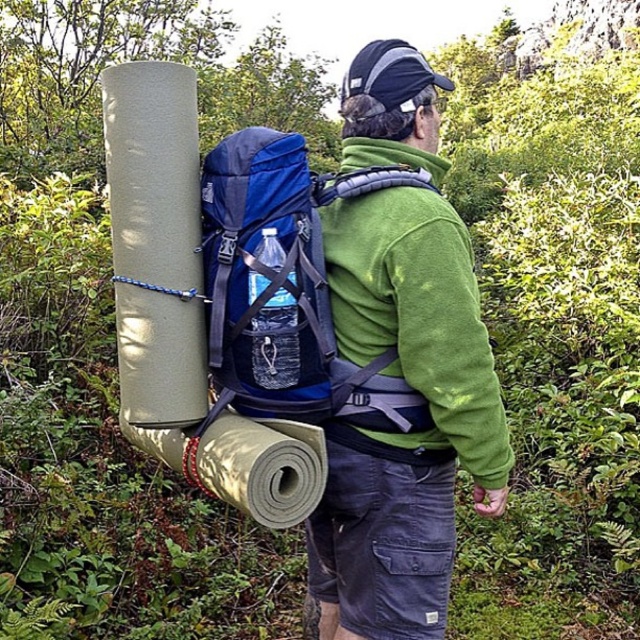
Question: Which point appears closest to the camera in this image?

Choices:
 (A) (369, 148)
 (B) (292, 189)

Answer: (B)

Question: Does blue fabric backpack at center appear over green fleece jacket at back?

Choices:
 (A) no
 (B) yes

Answer: (B)

Question: Can you confirm if blue fabric backpack at center is positioned to the left of green fleece jacket at back?

Choices:
 (A) yes
 (B) no

Answer: (A)

Question: Among these points, which one is farthest from the camera?

Choices:
 (A) (216, 312)
 (B) (506, 477)

Answer: (B)

Question: Is blue fabric backpack at center behind green fleece jacket at back?

Choices:
 (A) no
 (B) yes

Answer: (B)